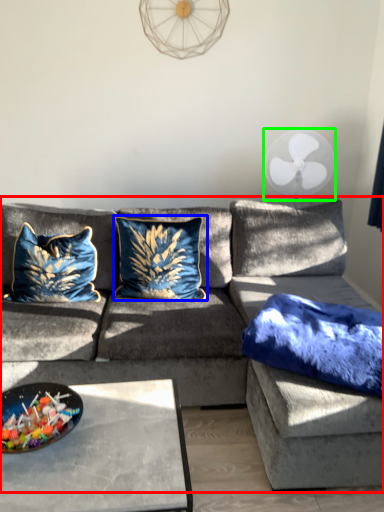
Question: Based on their relative distances, which object is farther from studio couch (highlighted by a red box)? Choose from pillow (highlighted by a blue box) and mechanical fan (highlighted by a green box).

Choices:
 (A) pillow
 (B) mechanical fan

Answer: (B)